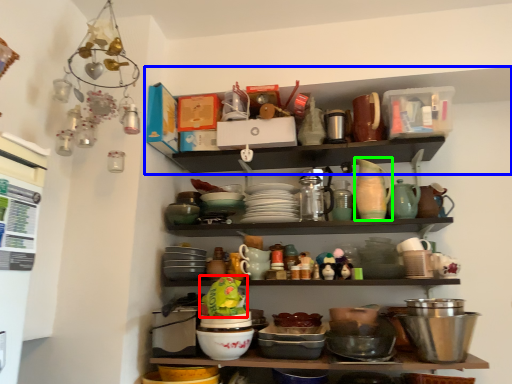
Question: Which object is positioned closest to food (highlighted by a red box)? Select from shelf (highlighted by a blue box) and tableware (highlighted by a green box).

Choices:
 (A) shelf
 (B) tableware

Answer: (B)